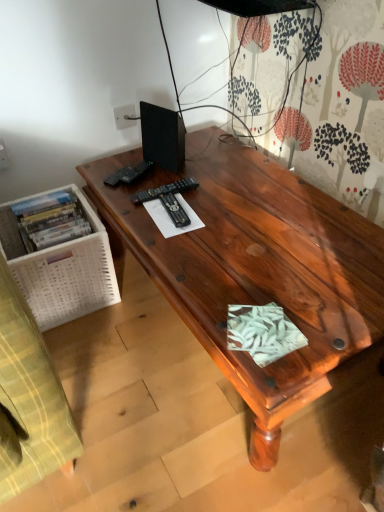
Locate an element on the screen. The height and width of the screenshot is (512, 384). free area behind black plastic remote control at upper left, marked as the third remote control in a front-to-back arrangement is located at coordinates (144, 158).